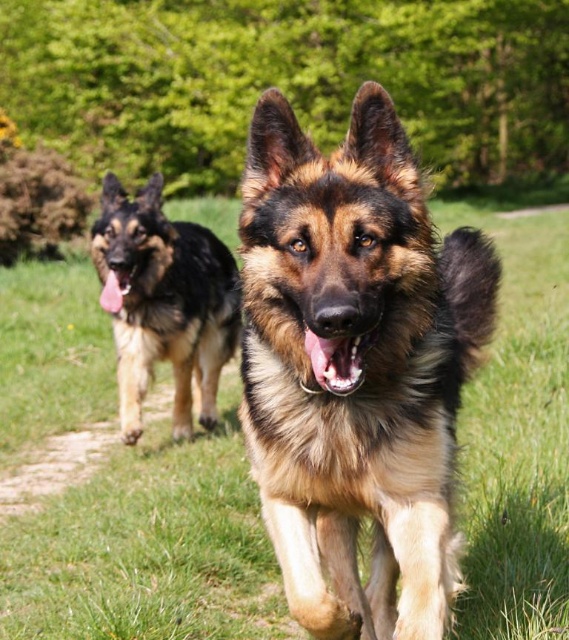
Question: In this image, where is brown soft grass at center located relative to smooth brown fur at center?

Choices:
 (A) below
 (B) above

Answer: (B)

Question: Considering the relative positions of brown fur dog at left and smooth brown fur at center in the image provided, where is brown fur dog at left located with respect to smooth brown fur at center?

Choices:
 (A) above
 (B) below

Answer: (A)

Question: Observing the image, what is the correct spatial positioning of brown shaggy dog at center in reference to smooth brown fur at center?

Choices:
 (A) below
 (B) above

Answer: (A)

Question: Among these points, which one is nearest to the camera?

Choices:
 (A) (321, 344)
 (B) (204, 300)
 (C) (265, 113)

Answer: (A)

Question: Considering the real-world distances, which object is farthest from the brown soft grass at center?

Choices:
 (A) brown shaggy dog at center
 (B) brown fur dog at left
 (C) smooth brown fur at center

Answer: (C)

Question: Among these objects, which one is nearest to the camera?

Choices:
 (A) smooth brown fur at center
 (B) brown fur dog at left
 (C) brown shaggy dog at center
 (D) brown soft grass at center

Answer: (C)